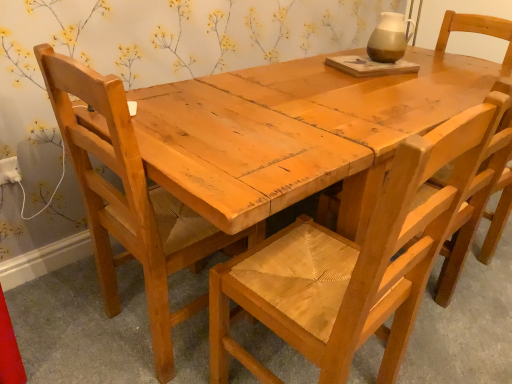
Question: Considering the relative sizes of wooden woven seat at center, which is counted as the 3th chair, starting from the left, and natural wood chair at center, which is counted as the 2th chair, starting from the left, in the image provided, is wooden woven seat at center, which is counted as the 3th chair, starting from the left, bigger than natural wood chair at center, which is counted as the 2th chair, starting from the left,?

Choices:
 (A) no
 (B) yes

Answer: (A)

Question: Is natural wood chair at center, placed as the second chair when sorted from right to left, at the back of wooden woven seat at center, which is counted as the 3th chair, starting from the left?

Choices:
 (A) no
 (B) yes

Answer: (A)

Question: From the image's perspective, does wooden woven seat at center, marked as the 1th chair in a right-to-left arrangement, appear lower than natural wood chair at center, placed as the second chair when sorted from right to left?

Choices:
 (A) yes
 (B) no

Answer: (B)

Question: Is wooden woven seat at center, which is counted as the 3th chair, starting from the left, outside natural wood chair at center, placed as the second chair when sorted from right to left?

Choices:
 (A) yes
 (B) no

Answer: (A)

Question: Is wooden woven seat at center, which is counted as the 3th chair, starting from the left, to the right of natural wood chair at center, placed as the second chair when sorted from right to left, from the viewer's perspective?

Choices:
 (A) yes
 (B) no

Answer: (A)

Question: Is wooden woven seat at center, which is counted as the 3th chair, starting from the left, shorter than natural wood chair at center, which is counted as the 2th chair, starting from the left?

Choices:
 (A) no
 (B) yes

Answer: (B)

Question: Is natural wood chair at left, marked as the 1th chair in a left-to-right arrangement, completely or partially outside of natural wood chair at center, placed as the second chair when sorted from right to left?

Choices:
 (A) yes
 (B) no

Answer: (A)

Question: Could you tell me if natural wood chair at left, marked as the 1th chair in a left-to-right arrangement, is turned towards natural wood chair at center, which is counted as the 2th chair, starting from the left?

Choices:
 (A) yes
 (B) no

Answer: (B)

Question: Can you confirm if natural wood chair at left, marked as the third chair in a right-to-left arrangement, is taller than natural wood chair at center, placed as the second chair when sorted from right to left?

Choices:
 (A) no
 (B) yes

Answer: (B)

Question: From the image's perspective, is natural wood chair at left, marked as the third chair in a right-to-left arrangement, below natural wood chair at center, placed as the second chair when sorted from right to left?

Choices:
 (A) yes
 (B) no

Answer: (B)

Question: Is there a large distance between natural wood chair at left, marked as the third chair in a right-to-left arrangement, and natural wood chair at center, placed as the second chair when sorted from right to left?

Choices:
 (A) yes
 (B) no

Answer: (B)

Question: Is natural wood chair at left, marked as the 1th chair in a left-to-right arrangement, to the left of natural wood chair at center, placed as the second chair when sorted from right to left, from the viewer's perspective?

Choices:
 (A) no
 (B) yes

Answer: (B)

Question: From the image's perspective, is natural wood chair at center, which is counted as the 2th chair, starting from the left, located beneath wooden woven seat at center, marked as the 1th chair in a right-to-left arrangement?

Choices:
 (A) no
 (B) yes

Answer: (B)